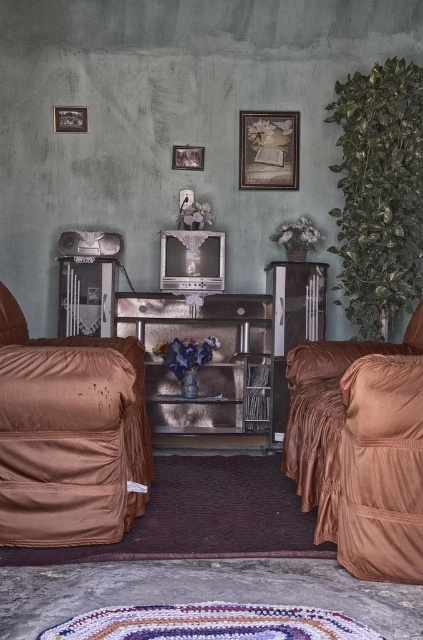
You are an interior designer looking at the vintage living room. You see the wooden frame at upper center and the wooden picture frame at upper left. Which one is positioned lower in the room?

The wooden frame at upper center is positioned lower than the wooden picture frame at upper left.

Please provide the 2D coordinates of the brown fabric armchair at left in the scene described.

The 2D coordinates of the brown fabric armchair at left are at point (68, 435).